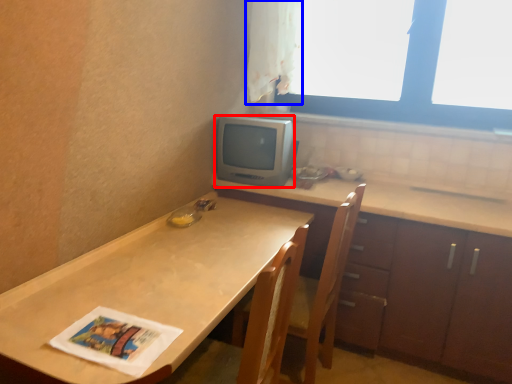
Question: Which object appears closest to the camera in this image, appliance (highlighted by a red box) or curtain (highlighted by a blue box)?

Choices:
 (A) appliance
 (B) curtain

Answer: (B)